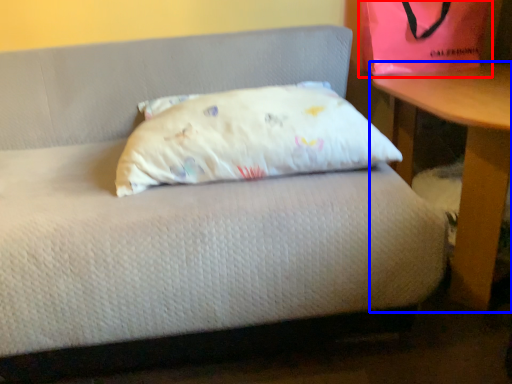
Question: Which of the following is the farthest to the observer, bean bag chair (highlighted by a red box) or table (highlighted by a blue box)?

Choices:
 (A) bean bag chair
 (B) table

Answer: (A)